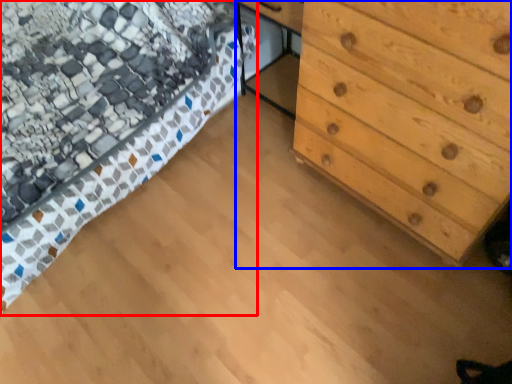
Question: Among these objects, which one is farthest to the camera, bed (highlighted by a red box) or chest of drawers (highlighted by a blue box)?

Choices:
 (A) bed
 (B) chest of drawers

Answer: (A)